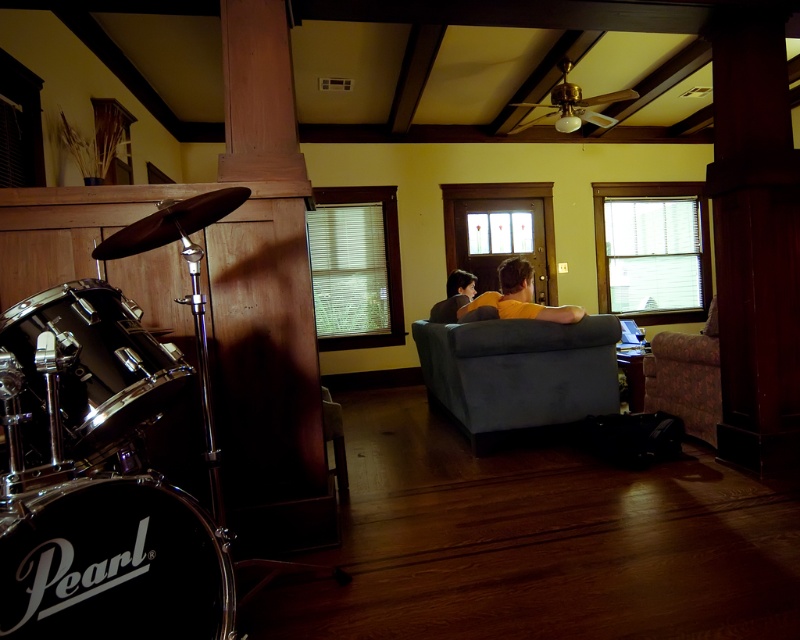
Who is shorter, shiny chrome drum at left or floral fabric couch at right?

shiny chrome drum at left is shorter.

Who is more distant from viewer, (22, 316) or (694, 355)?

Positioned behind is point (694, 355).

At what (x,y) coordinates should I click in order to perform the action: click on shiny chrome drum at left. Please return your answer as a coordinate pair (x, y). The height and width of the screenshot is (640, 800). Looking at the image, I should click on (90, 369).

Is black pearl drum at lower left shorter than velvet blue ottoman at center?

Yes, black pearl drum at lower left is shorter than velvet blue ottoman at center.

What do you see at coordinates (113, 563) in the screenshot?
I see `black pearl drum at lower left` at bounding box center [113, 563].

The image size is (800, 640). I want to click on black pearl drum at lower left, so click(x=113, y=563).

Between black pearl drum at lower left and floral fabric couch at right, which one is positioned higher?

floral fabric couch at right is higher up.

Based on the photo, is black pearl drum at lower left smaller than floral fabric couch at right?

Yes.

In order to click on black pearl drum at lower left in this screenshot , I will do `click(113, 563)`.

This screenshot has height=640, width=800. In order to click on black pearl drum at lower left in this screenshot , I will do `click(113, 563)`.